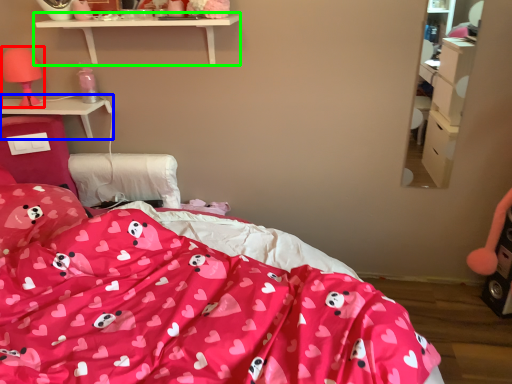
Question: Based on their relative distances, which object is farther from table lamp (highlighted by a red box)? Choose from desk (highlighted by a blue box) and shelf (highlighted by a green box).

Choices:
 (A) desk
 (B) shelf

Answer: (B)